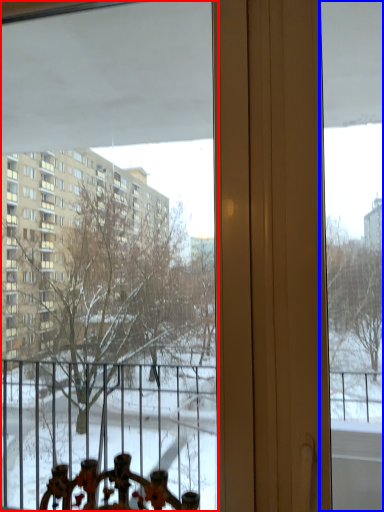
Question: Which point is further to the camera, window (highlighted by a red box) or window screen (highlighted by a blue box)?

Choices:
 (A) window
 (B) window screen

Answer: (A)